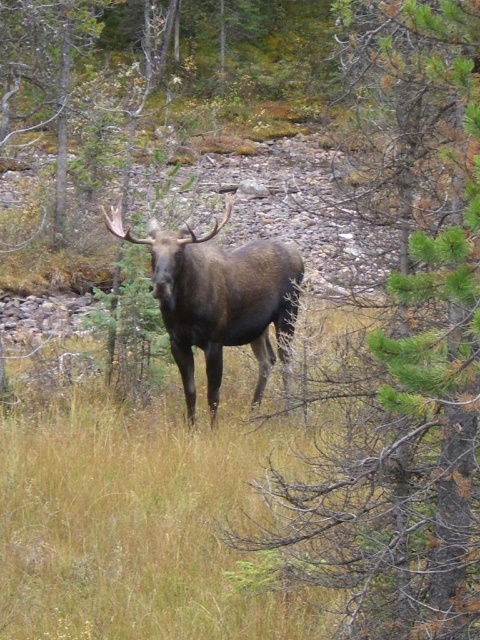
Question: Is green leafy tree at center below brown furry moose at center?

Choices:
 (A) no
 (B) yes

Answer: (B)

Question: Can you confirm if green leafy tree at center is thinner than brown furry moose at center?

Choices:
 (A) yes
 (B) no

Answer: (A)

Question: Which of the following is the farthest from the observer?

Choices:
 (A) brown furry moose at center
 (B) green leafy tree at center

Answer: (A)

Question: Where is green leafy tree at center located in relation to brown furry moose at center in the image?

Choices:
 (A) below
 (B) above

Answer: (A)